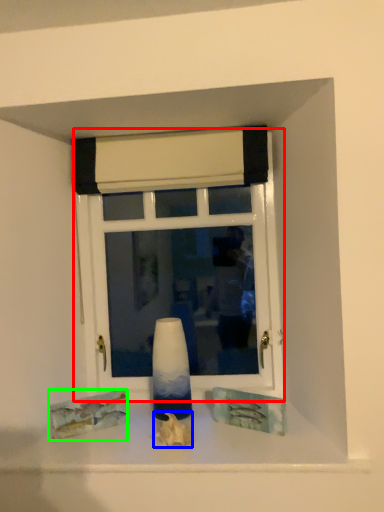
Question: Based on their relative distances, which object is nearer to window (highlighted by a red box)? Choose from art (highlighted by a blue box) and art (highlighted by a green box).

Choices:
 (A) art
 (B) art

Answer: (B)